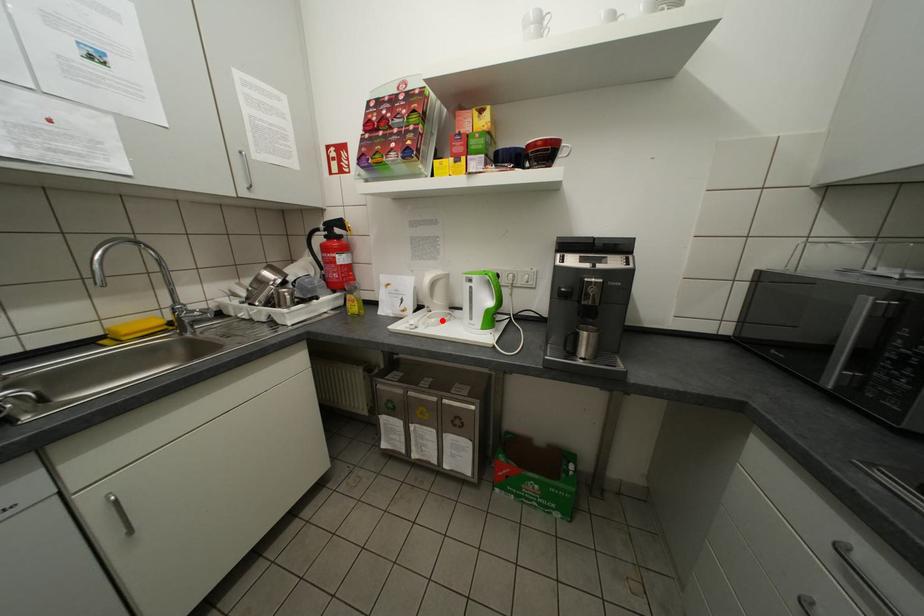
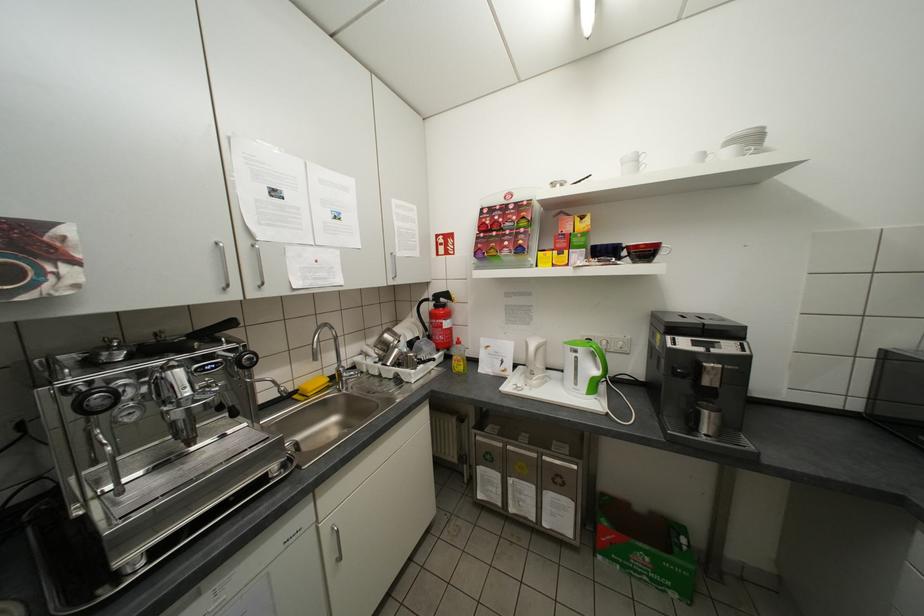
In the second image, find the point that corresponds to the highlighted location in the first image.

(543, 382)